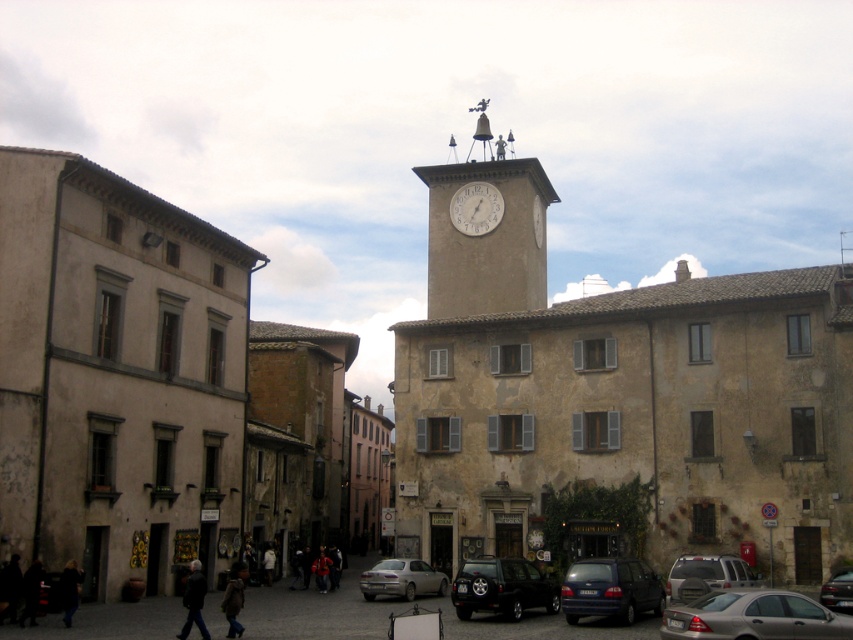
Question: Which object is farther from the camera taking this photo?

Choices:
 (A) silver metallic sedan at center
 (B) matte gray suv at center
 (C) matte silver sedan at center

Answer: (A)

Question: Which is farther from the matte gray suv at center?

Choices:
 (A) beige stone clock tower at center
 (B) shiny black car at lower right
 (C) shiny black suv at center
 (D) silver metallic sedan at center

Answer: (A)

Question: Can you confirm if matte blue van at center is smaller than matte gray suv at center?

Choices:
 (A) yes
 (B) no

Answer: (B)

Question: Is matte blue van at center smaller than shiny black car at lower right?

Choices:
 (A) no
 (B) yes

Answer: (A)

Question: Does matte silver sedan at center have a lesser width compared to white matte clock at upper center?

Choices:
 (A) no
 (B) yes

Answer: (A)

Question: Which object appears farthest from the camera in this image?

Choices:
 (A) matte gray suv at center
 (B) matte silver sedan at center
 (C) beige stone clock tower at center
 (D) silver metallic sedan at center

Answer: (C)